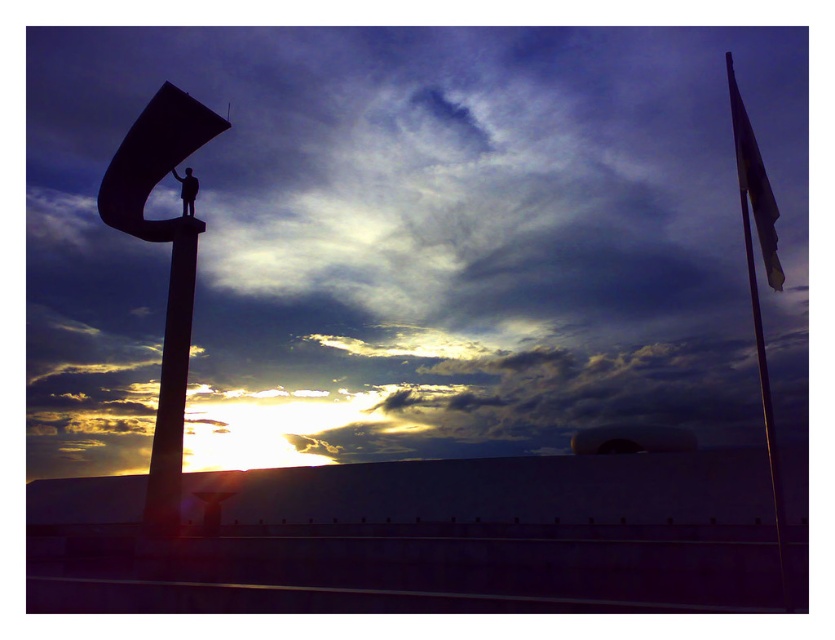
Who is more forward, (x=165, y=330) or (x=181, y=192)?

Positioned in front is point (x=165, y=330).

Find the location of a particular element. This screenshot has height=640, width=835. smooth concrete pole at center is located at coordinates coord(171,378).

Find the location of `smooth concrete pole at center`. smooth concrete pole at center is located at coordinates (x=171, y=378).

The image size is (835, 640). Identify the location of smooth concrete pole at center. (171, 378).

Is cloudy sky at upper center below metallic flag pole at right?

No.

Does point (645, 266) lie behind point (777, 477)?

Yes, it is.

Where is `cloudy sky at upper center`? This screenshot has height=640, width=835. cloudy sky at upper center is located at coordinates (415, 241).

Is point (122, 186) farther from viewer compared to point (164, 484)?

Yes, it is.

Where is `silhouette metal sculpture at left`? silhouette metal sculpture at left is located at coordinates (170, 269).